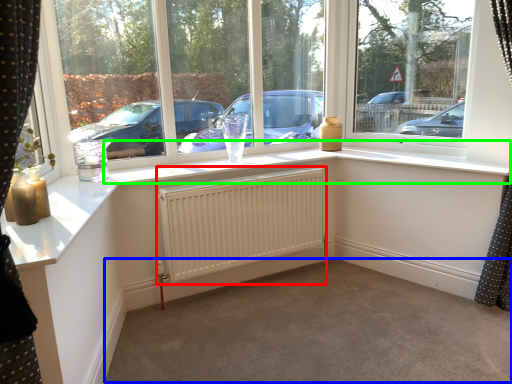
Question: Which is farther away from radiator (highlighted by a red box)? plain (highlighted by a blue box) or window sill (highlighted by a green box)?

Choices:
 (A) plain
 (B) window sill

Answer: (A)